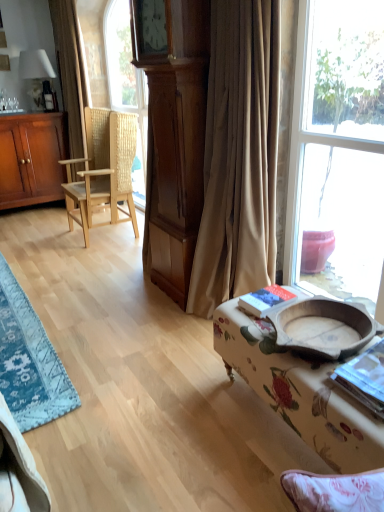
Question: Should I look upward or downward to see beige fabric curtain at center, positioned as the 2th curtain in left-to-right order?

Choices:
 (A) up
 (B) down

Answer: (A)

Question: Is blue woven rug at lower left thinner than floral fabric ottoman at lower right?

Choices:
 (A) no
 (B) yes

Answer: (A)

Question: From a real-world perspective, is blue woven rug at lower left on top of floral fabric ottoman at lower right?

Choices:
 (A) yes
 (B) no

Answer: (B)

Question: Is blue woven rug at lower left aimed at floral fabric ottoman at lower right?

Choices:
 (A) no
 (B) yes

Answer: (A)

Question: Is blue woven rug at lower left at the right side of floral fabric ottoman at lower right?

Choices:
 (A) no
 (B) yes

Answer: (A)

Question: From the image's perspective, is blue woven rug at lower left below floral fabric ottoman at lower right?

Choices:
 (A) no
 (B) yes

Answer: (A)

Question: Is blue woven rug at lower left in contact with floral fabric ottoman at lower right?

Choices:
 (A) no
 (B) yes

Answer: (A)

Question: Could you tell me if brown textured curtain at left, the first curtain when ordered from left to right, is facing blue woven rug at lower left?

Choices:
 (A) yes
 (B) no

Answer: (B)

Question: Is brown textured curtain at left, which ranks as the 1th curtain in back-to-front order, bigger than blue woven rug at lower left?

Choices:
 (A) no
 (B) yes

Answer: (B)

Question: Can you confirm if brown textured curtain at left, which ranks as the 1th curtain in back-to-front order, is wider than blue woven rug at lower left?

Choices:
 (A) yes
 (B) no

Answer: (B)

Question: Does brown textured curtain at left, the second curtain viewed from the right, have a greater height compared to blue woven rug at lower left?

Choices:
 (A) yes
 (B) no

Answer: (A)

Question: Does brown textured curtain at left, which is the 2th curtain in front-to-back order, come in front of blue woven rug at lower left?

Choices:
 (A) yes
 (B) no

Answer: (B)

Question: Can you see brown textured curtain at left, the second curtain viewed from the right, touching blue woven rug at lower left?

Choices:
 (A) no
 (B) yes

Answer: (A)

Question: Does natural wood woven chair at left have a lesser width compared to beige fabric curtain at center, placed as the second curtain when sorted from back to front?

Choices:
 (A) no
 (B) yes

Answer: (A)